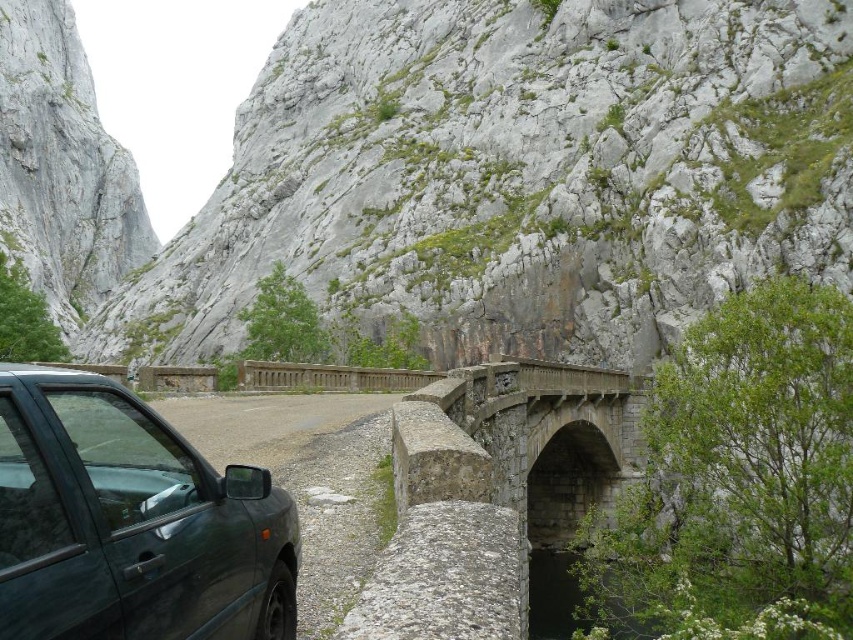
The width and height of the screenshot is (853, 640). In order to click on gray rock wall at upper center in this screenshot , I will do `click(444, 173)`.

Identify the location of gray rock wall at upper center. (444, 173).

This screenshot has width=853, height=640. Find the location of `gray rock wall at upper center`. gray rock wall at upper center is located at coordinates (444, 173).

Does gray rock wall at upper center appear over stone arch bridge at center?

Correct, gray rock wall at upper center is located above stone arch bridge at center.

Which is more to the right, gray rock wall at upper center or stone arch bridge at center?

stone arch bridge at center

Which is in front, point (782, 193) or point (561, 525)?

Point (782, 193) is more forward.

What are the coordinates of `gray rock wall at upper center` in the screenshot? It's located at (444, 173).

Can you confirm if dark green matte car at lower left is smaller than green matte car at lower left?

Indeed, dark green matte car at lower left has a smaller size compared to green matte car at lower left.

Can you confirm if dark green matte car at lower left is positioned above green matte car at lower left?

Yes.

Is point (61, 506) closer to camera compared to point (302, 440)?

Yes, point (61, 506) is in front of point (302, 440).

Locate an element on the screen. dark green matte car at lower left is located at coordinates (131, 522).